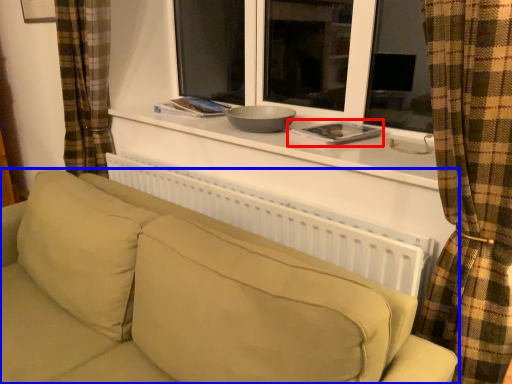
Question: Among these objects, which one is nearest to the camera, book (highlighted by a red box) or studio couch (highlighted by a blue box)?

Choices:
 (A) book
 (B) studio couch

Answer: (B)